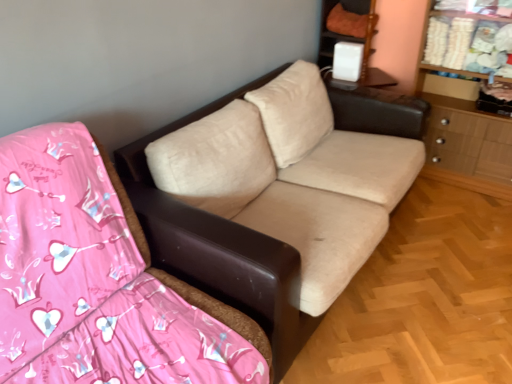
Question: Does beige fabric couch at center come behind white plastic speaker at upper right?

Choices:
 (A) no
 (B) yes

Answer: (A)

Question: Is beige fabric couch at center not within white plastic speaker at upper right?

Choices:
 (A) no
 (B) yes

Answer: (B)

Question: Is beige fabric couch at center smaller than white plastic speaker at upper right?

Choices:
 (A) no
 (B) yes

Answer: (B)

Question: Can you confirm if beige fabric couch at center is taller than white plastic speaker at upper right?

Choices:
 (A) no
 (B) yes

Answer: (A)

Question: Can you confirm if beige fabric couch at center is wider than white plastic speaker at upper right?

Choices:
 (A) no
 (B) yes

Answer: (B)

Question: Considering the relative positions of beige fabric couch at center and white plastic speaker at upper right in the image provided, is beige fabric couch at center to the right of white plastic speaker at upper right from the viewer's perspective?

Choices:
 (A) no
 (B) yes

Answer: (A)

Question: Can we say white plastic speaker at upper right lies outside wooden dresser at right?

Choices:
 (A) yes
 (B) no

Answer: (A)

Question: Is white plastic speaker at upper right bigger than wooden dresser at right?

Choices:
 (A) no
 (B) yes

Answer: (A)

Question: From a real-world perspective, is white plastic speaker at upper right beneath wooden dresser at right?

Choices:
 (A) no
 (B) yes

Answer: (A)

Question: Are white plastic speaker at upper right and wooden dresser at right located far from each other?

Choices:
 (A) no
 (B) yes

Answer: (A)

Question: From the image's perspective, would you say white plastic speaker at upper right is shown under wooden dresser at right?

Choices:
 (A) yes
 (B) no

Answer: (B)

Question: Does white plastic speaker at upper right have a greater height compared to wooden dresser at right?

Choices:
 (A) no
 (B) yes

Answer: (A)

Question: Is white plastic speaker at upper right taller than beige fabric couch at center?

Choices:
 (A) no
 (B) yes

Answer: (B)